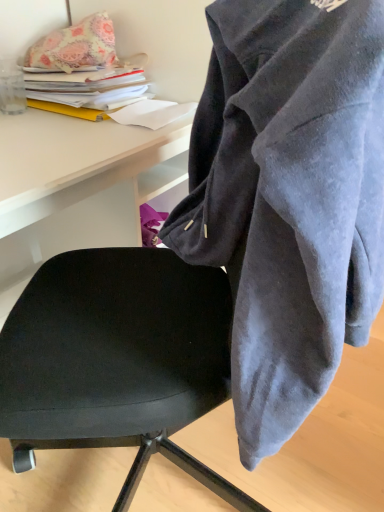
Question: Does point click(x=340, y=196) appear closer or farther from the camera than point click(x=97, y=50)?

Choices:
 (A) closer
 (B) farther

Answer: (A)

Question: In terms of height, does velvet gray hoodie at center look taller or shorter compared to floral fabric pillow at upper left?

Choices:
 (A) short
 (B) tall

Answer: (B)

Question: Estimate the real-world distances between objects in this image. Which object is farther from the black leather chair at center?

Choices:
 (A) velvet gray hoodie at center
 (B) floral fabric pillow at upper left

Answer: (B)

Question: Estimate the real-world distances between objects in this image. Which object is closer to the velvet gray hoodie at center?

Choices:
 (A) floral fabric pillow at upper left
 (B) black leather chair at center

Answer: (B)